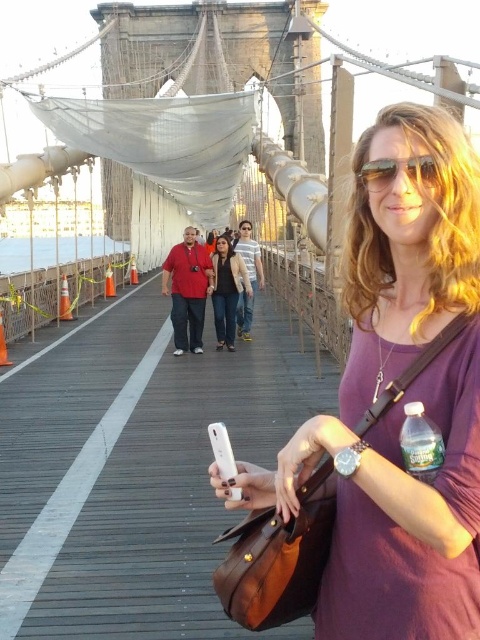
Question: Which object appears closest to the camera in this image?

Choices:
 (A) purple leather shirt at center
 (B) sunglasses at center
 (C) matte black jacket at center
 (D) clear plastic bottle at lower right

Answer: (A)

Question: Among these points, which one is nearest to the camera?

Choices:
 (A) (224, 296)
 (B) (350, 467)
 (C) (420, 470)
 (D) (369, 184)

Answer: (C)

Question: Among these points, which one is nearest to the camera?

Choices:
 (A) (239, 257)
 (B) (425, 429)
 (C) (432, 177)
 (D) (389, 205)

Answer: (B)

Question: Does purple leather shirt at center have a lesser width compared to clear plastic bottle at lower right?

Choices:
 (A) yes
 (B) no

Answer: (B)

Question: From the image, what is the correct spatial relationship of purple leather shirt at center in relation to clear plastic bottle at lower right?

Choices:
 (A) above
 (B) below

Answer: (A)

Question: Is purple leather shirt at center behind sunglasses at center?

Choices:
 (A) no
 (B) yes

Answer: (A)